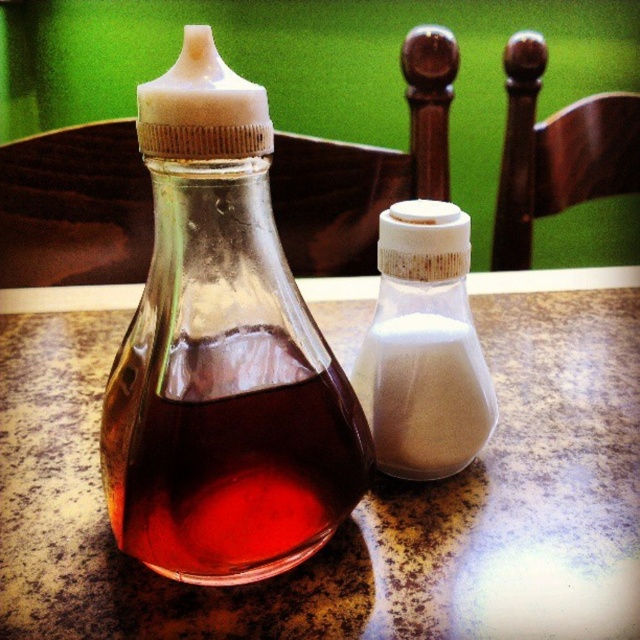
Which is more to the left, transparent glass bottle at center or translucent glass bottle at center?

transparent glass bottle at center is more to the left.

Who is more forward, (195, 394) or (141, 451)?

Positioned in front is point (195, 394).

Is point (182, 513) less distant than point (145, 497)?

That is True.

This screenshot has height=640, width=640. I want to click on transparent glass bottle at center, so click(x=221, y=355).

Does brown marble table at center have a smaller size compared to transparent glass bottle at center?

Incorrect, brown marble table at center is not smaller in size than transparent glass bottle at center.

Is point (179, 637) closer to camera compared to point (276, 444)?

No, it is behind (276, 444).

Locate an element on the screen. brown marble table at center is located at coordinates (364, 496).

Does translucent glass bottle at center appear over white matte salt shaker at center?

Incorrect, translucent glass bottle at center is not positioned above white matte salt shaker at center.

Can you confirm if translucent glass bottle at center is bigger than white matte salt shaker at center?

Incorrect, translucent glass bottle at center is not larger than white matte salt shaker at center.

Between point (132, 422) and point (433, 262), which one is positioned behind?

Positioned behind is point (433, 262).

Find the location of `translucent glass bottle at center`. translucent glass bottle at center is located at coordinates (228, 458).